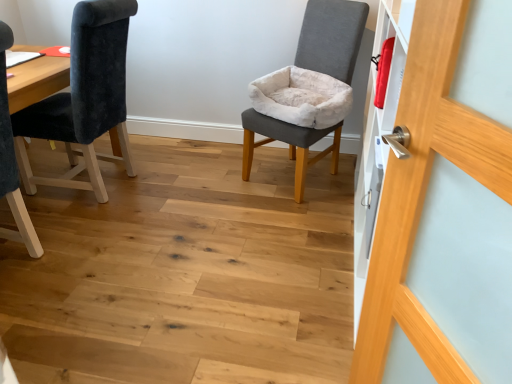
Where is `velvet dark blue chair at left, the 2th chair viewed from the right`? This screenshot has width=512, height=384. velvet dark blue chair at left, the 2th chair viewed from the right is located at coordinates (84, 97).

At what (x,y) coordinates should I click in order to perform the action: click on gray fabric chair at center, placed as the 2th chair when sorted from left to right. Please return your answer as a coordinate pair (x, y). The image size is (512, 384). Looking at the image, I should click on (332, 37).

Locate an element on the screen. Image resolution: width=512 pixels, height=384 pixels. velvet dark blue chair at left, which is the 1th chair in left-to-right order is located at coordinates (84, 97).

Does wooden door handle at right have a larger size compared to velvet dark blue chair at left, which is the 1th chair in left-to-right order?

Actually, wooden door handle at right might be smaller than velvet dark blue chair at left, which is the 1th chair in left-to-right order.

Is wooden door handle at right positioned far away from velvet dark blue chair at left, the 2th chair viewed from the right?

Yes, wooden door handle at right and velvet dark blue chair at left, the 2th chair viewed from the right, are quite far apart.

Considering the positions of points (391, 210) and (76, 16), is point (391, 210) farther from camera compared to point (76, 16)?

That is False.

From the picture: Is wooden door handle at right aimed at velvet dark blue chair at left, the 2th chair viewed from the right?

No, wooden door handle at right is not facing towards velvet dark blue chair at left, the 2th chair viewed from the right.

Does gray fabric chair at center, the 1th chair viewed from the right, turn towards velvet dark blue chair at left, the 2th chair viewed from the right?

No, gray fabric chair at center, the 1th chair viewed from the right, is not oriented towards velvet dark blue chair at left, the 2th chair viewed from the right.

Which object is closer to the camera taking this photo, gray fabric chair at center, the 1th chair viewed from the right, or velvet dark blue chair at left, which is the 1th chair in left-to-right order?

velvet dark blue chair at left, which is the 1th chair in left-to-right order, is more forward.

Is point (305, 140) positioned behind point (39, 131)?

Yes.

From the image's perspective, who appears lower, gray fabric chair at center, placed as the 2th chair when sorted from left to right, or wooden door handle at right?

wooden door handle at right, from the image's perspective.

Does point (267, 132) lie behind point (417, 312)?

Yes, it is behind point (417, 312).

From a real-world perspective, between gray fabric chair at center, the 1th chair viewed from the right, and wooden door handle at right, who is vertically higher?

wooden door handle at right is physically above.

Which of these two, gray fabric chair at center, placed as the 2th chair when sorted from left to right, or wooden door handle at right, is bigger?

gray fabric chair at center, placed as the 2th chair when sorted from left to right, is bigger.

Who is bigger, velvet dark blue chair at left, the 2th chair viewed from the right, or gray fabric chair at center, placed as the 2th chair when sorted from left to right?

With larger size is gray fabric chair at center, placed as the 2th chair when sorted from left to right.

Considering the positions of objects velvet dark blue chair at left, the 2th chair viewed from the right, and gray fabric chair at center, placed as the 2th chair when sorted from left to right, in the image provided, who is behind, velvet dark blue chair at left, the 2th chair viewed from the right, or gray fabric chair at center, placed as the 2th chair when sorted from left to right,?

gray fabric chair at center, placed as the 2th chair when sorted from left to right, is further away from the camera.

Does velvet dark blue chair at left, the 2th chair viewed from the right, turn towards gray fabric chair at center, the 1th chair viewed from the right?

No, velvet dark blue chair at left, the 2th chair viewed from the right, is not turned towards gray fabric chair at center, the 1th chair viewed from the right.

Is wooden door handle at right bigger than gray fabric chair at center, placed as the 2th chair when sorted from left to right?

No.

Is wooden door handle at right not within gray fabric chair at center, the 1th chair viewed from the right?

Absolutely, wooden door handle at right is external to gray fabric chair at center, the 1th chair viewed from the right.

Is wooden door handle at right to the right of gray fabric chair at center, placed as the 2th chair when sorted from left to right, from the viewer's perspective?

Yes.

From a real-world perspective, relative to wooden door handle at right, is velvet dark blue chair at left, the 2th chair viewed from the right, vertically above or below?

Clearly, from a real-world perspective, velvet dark blue chair at left, the 2th chair viewed from the right, is below wooden door handle at right.

Considering the sizes of objects velvet dark blue chair at left, the 2th chair viewed from the right, and wooden door handle at right in the image provided, who is bigger, velvet dark blue chair at left, the 2th chair viewed from the right, or wooden door handle at right?

With larger size is velvet dark blue chair at left, the 2th chair viewed from the right.

Looking at this image, considering the relative positions of velvet dark blue chair at left, the 2th chair viewed from the right, and wooden door handle at right in the image provided, is velvet dark blue chair at left, the 2th chair viewed from the right, to the right of wooden door handle at right from the viewer's perspective?

No.

Consider the image. From the image's perspective, which one is positioned higher, velvet dark blue chair at left, which is the 1th chair in left-to-right order, or wooden door handle at right?

velvet dark blue chair at left, which is the 1th chair in left-to-right order, appears higher in the image.

At what (x,y) coordinates should I click in order to perform the action: click on the 2nd chair counting from the left of the wooden door handle at right. Please return your answer as a coordinate pair (x, y). The height and width of the screenshot is (384, 512). Looking at the image, I should click on (84, 97).

Locate an element on the screen. Image resolution: width=512 pixels, height=384 pixels. chair above the gray fabric chair at center, placed as the 2th chair when sorted from left to right (from a real-world perspective) is located at coordinates (84, 97).

Which object lies nearer to the anchor point velvet dark blue chair at left, which is the 1th chair in left-to-right order, wooden door handle at right or gray fabric chair at center, placed as the 2th chair when sorted from left to right?

gray fabric chair at center, placed as the 2th chair when sorted from left to right.

From the image, which object appears to be nearer to velvet dark blue chair at left, the 2th chair viewed from the right, gray fabric chair at center, the 1th chair viewed from the right, or wooden door handle at right?

The object closer to velvet dark blue chair at left, the 2th chair viewed from the right, is gray fabric chair at center, the 1th chair viewed from the right.

From the image, which object appears to be nearer to gray fabric chair at center, the 1th chair viewed from the right, velvet dark blue chair at left, which is the 1th chair in left-to-right order, or wooden door handle at right?

velvet dark blue chair at left, which is the 1th chair in left-to-right order.

Considering their positions, is velvet dark blue chair at left, which is the 1th chair in left-to-right order, positioned further to wooden door handle at right than gray fabric chair at center, placed as the 2th chair when sorted from left to right?

velvet dark blue chair at left, which is the 1th chair in left-to-right order, is positioned further to the anchor wooden door handle at right.

Which object lies further to the anchor point gray fabric chair at center, placed as the 2th chair when sorted from left to right, wooden door handle at right or velvet dark blue chair at left, the 2th chair viewed from the right?

wooden door handle at right lies further to gray fabric chair at center, placed as the 2th chair when sorted from left to right, than the other object.

Based on their spatial positions, is gray fabric chair at center, placed as the 2th chair when sorted from left to right, or velvet dark blue chair at left, the 2th chair viewed from the right, closer to wooden door handle at right?

The object closer to wooden door handle at right is gray fabric chair at center, placed as the 2th chair when sorted from left to right.

In order to click on chair between wooden door handle at right and gray fabric chair at center, the 1th chair viewed from the right, in the front-back direction in this screenshot , I will do `click(84, 97)`.